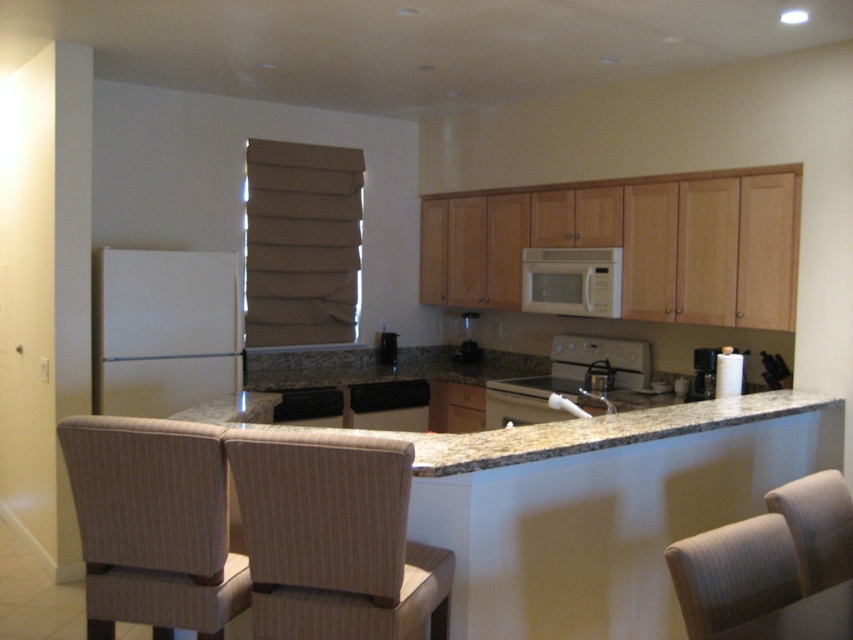
Can you confirm if beige fabric armchair at lower right is thinner than black matte dishwasher at center?

Indeed, beige fabric armchair at lower right has a lesser width compared to black matte dishwasher at center.

Is beige fabric armchair at lower right to the left of black matte dishwasher at center from the viewer's perspective?

Incorrect, beige fabric armchair at lower right is not on the left side of black matte dishwasher at center.

At what (x,y) coordinates should I click in order to perform the action: click on beige fabric armchair at lower right. Please return your answer as a coordinate pair (x, y). Looking at the image, I should click on 817,528.

Who is taller, white glossy kettle at center or beige fabric armchair at lower right?

Standing taller between the two is white glossy kettle at center.

Between point (558, 390) and point (846, 516), which one is positioned in front?

Positioned in front is point (846, 516).

This screenshot has width=853, height=640. Identify the location of white glossy kettle at center. (569, 380).

Measure the distance between point [837,548] and camera.

7.25 feet

Who is higher up, beige fabric armchair at lower right or white matte microwave at upper center?

Positioned higher is white matte microwave at upper center.

Is point (845, 531) closer to viewer compared to point (590, 268)?

Yes, it is.

The height and width of the screenshot is (640, 853). I want to click on beige fabric armchair at lower right, so click(x=817, y=528).